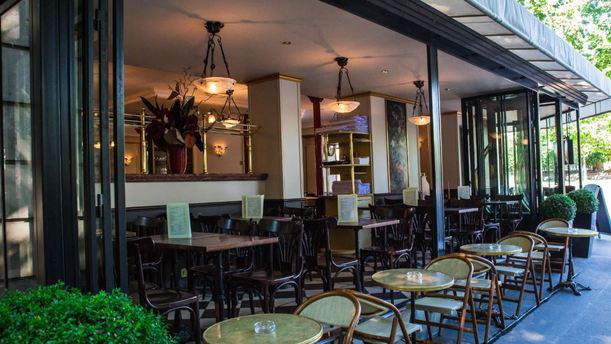
Locate an element on the screen. The height and width of the screenshot is (344, 611). hanging lights is located at coordinates (220, 82), (233, 120), (351, 105), (422, 120).